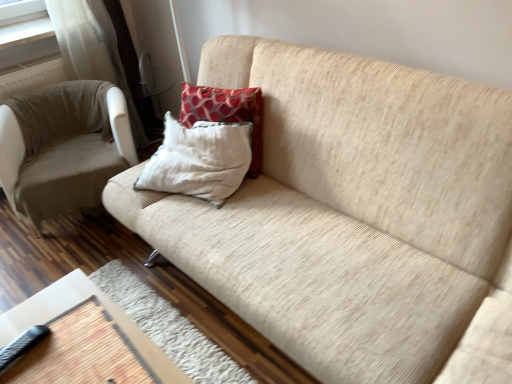
Find the location of `free space above wooden table at lower left (from a real-world perspective)`. free space above wooden table at lower left (from a real-world perspective) is located at coordinates (82, 342).